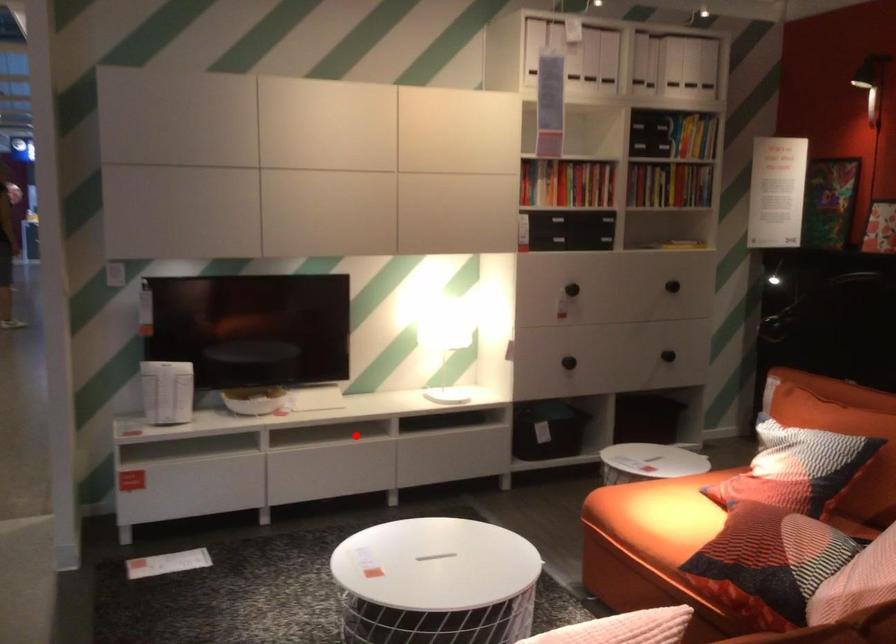
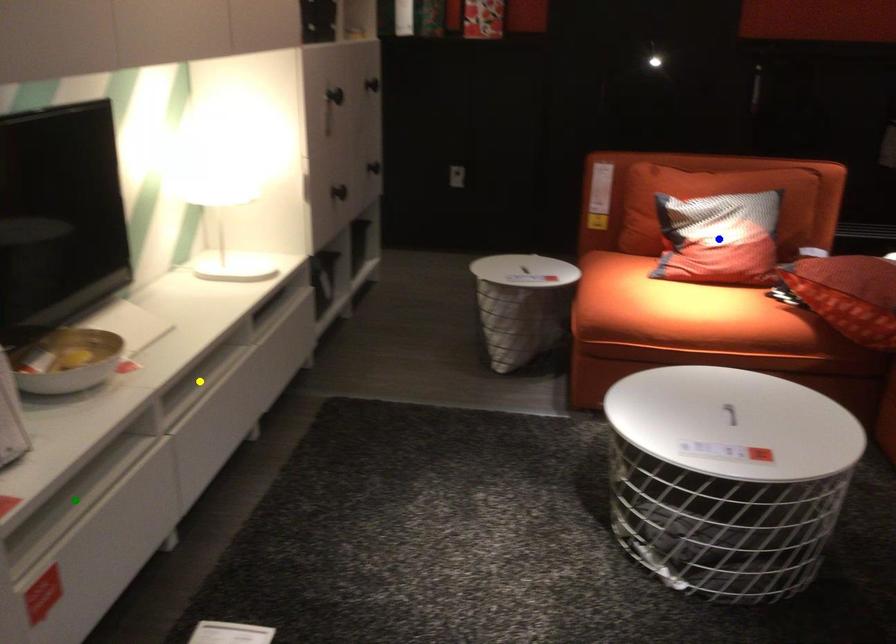
Question: I am providing you with two images of the same scene from different viewpoints. A red point is marked on the first image. You are given multiple points on the second image. Which spot in image 2 lines up with the point in image 1?

Choices:
 (A) blue point
 (B) yellow point
 (C) green point

Answer: (B)